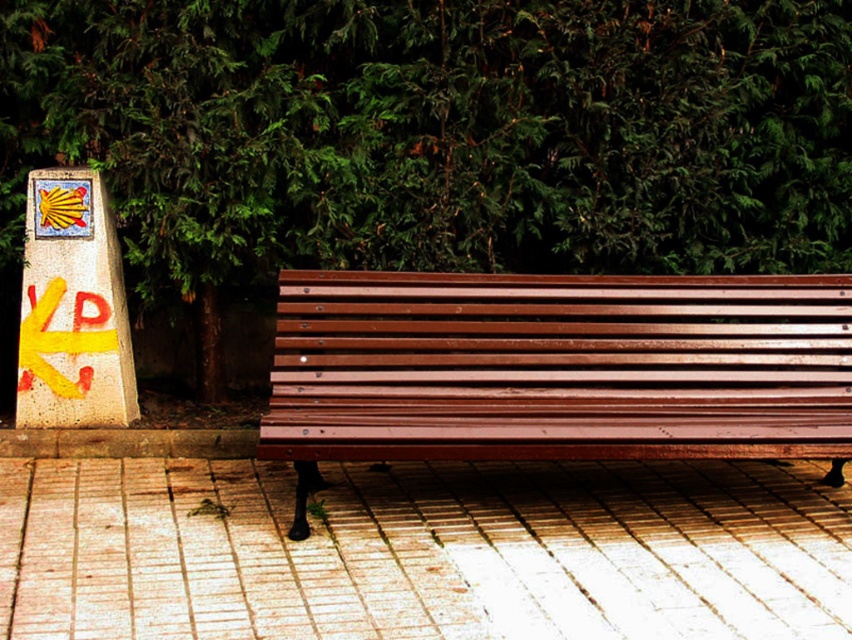
Is wooden bench at center bigger than yellow painted stone signpost at left?

Yes.

Identify the location of wooden bench at center. The image size is (852, 640). (556, 369).

Does point (850, 172) lie behind point (343, 397)?

Yes, point (850, 172) is behind point (343, 397).

Who is more distant from viewer, (658, 212) or (809, 323)?

The point (658, 212) is more distant.

Is point (502, 212) closer to camera compared to point (709, 285)?

No, (502, 212) is further to viewer.

Find the location of a particular element. Image resolution: width=852 pixels, height=640 pixels. green leafy tree at upper center is located at coordinates (436, 132).

Who is taller, green leafy tree at upper center or yellow painted stone signpost at left?

Standing taller between the two is green leafy tree at upper center.

Can you confirm if green leafy tree at upper center is shorter than yellow painted stone signpost at left?

In fact, green leafy tree at upper center may be taller than yellow painted stone signpost at left.

Is point (464, 29) positioned in front of point (42, 291)?

No, (464, 29) is further to viewer.

Where is `green leafy tree at upper center`? This screenshot has height=640, width=852. green leafy tree at upper center is located at coordinates (436, 132).